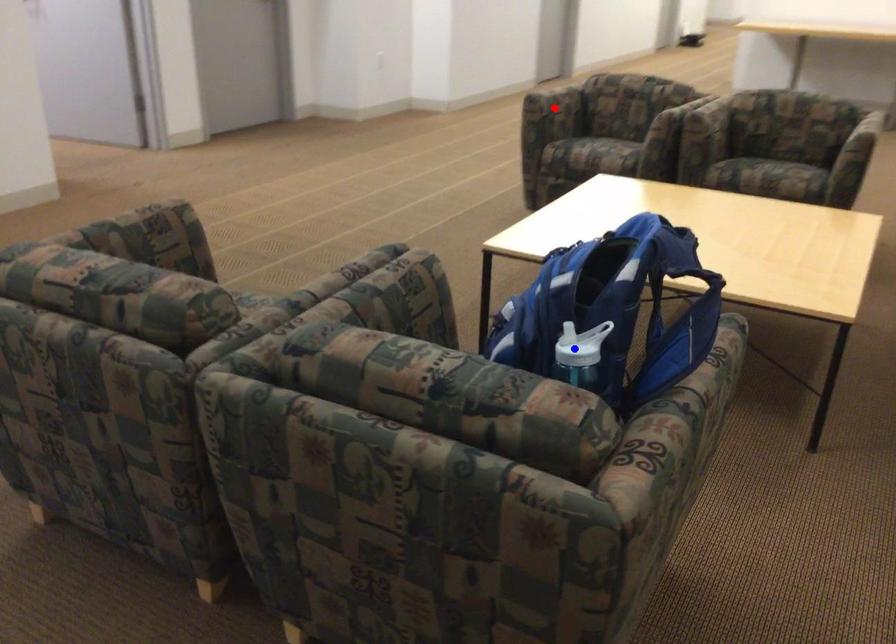
Question: Which of the two points in the image is closer to the camera?

Choices:
 (A) Blue point is closer.
 (B) Red point is closer.

Answer: (A)